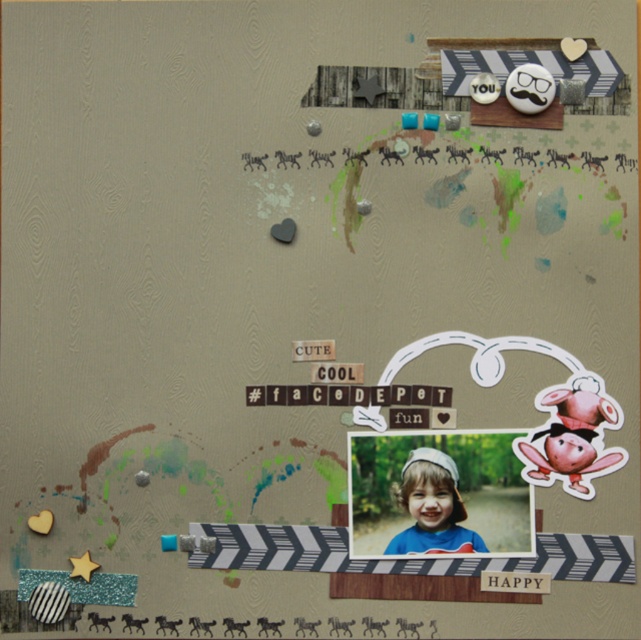
You are designing a scrapbook layout and need to place a matte blue shirt at center and a cute paper at center. According to the existing design, how far apart are these two elements?

The matte blue shirt at center is 3.17 inches away from the cute paper at center.

Looking at the scrapbook page with a rustic wood background, you see a matte blue shirt at center and a cute paper at center. Which object is positioned more to the left?

The cute paper at center is positioned more to the left than the matte blue shirt at center.

Based on the photo, you are a character in a video game that needs to find a specific location on a map. The map shows a point at coordinates (433, 508). What object is located at that point?

The point at coordinates (433, 508) corresponds to the matte blue shirt at center.